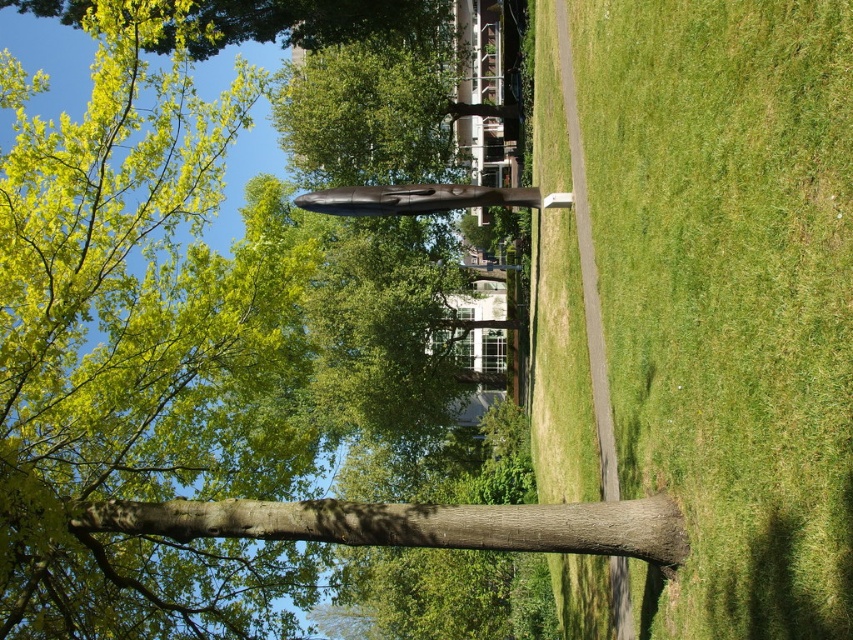
You are standing at the entrance of the park and want to reach the modern sculpture. According to the image, where should you head relative to the green grass at center?

The modern sculpture is located in the midground, so you should head towards the green grass at center which is at point (728,296) to reach it.

You are standing in the park and want to walk from the brown rough tree trunk at center to the green grass at center. Which direction should you move relative to the tree trunk?

You should move to the right relative to the brown rough tree trunk at center because the green grass at center is located to its right side.

You are standing in the park and want to take a photo of the green grass at center and the brown rough tree trunk at center. Which object should you focus on first to ensure both are in clear view?

You should focus on the green grass at center first since it is closer to the viewer than the brown rough tree trunk at center, ensuring both will be in focus when focused on the closer object.